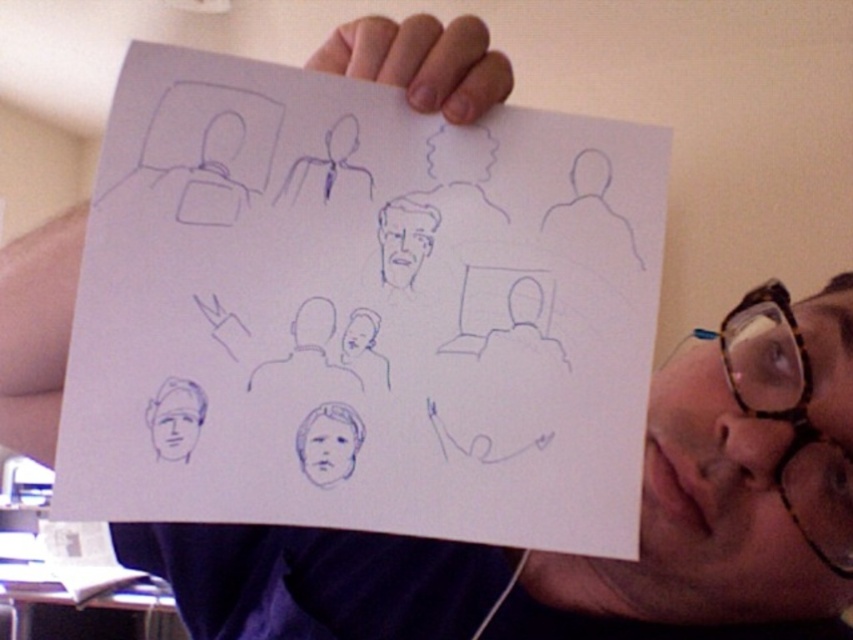
You are an art student who wants to view the blue pencil drawing at center from a distance of at least 40 centimeters to get a better perspective. Based on the information provided, can you stand back far enough to achieve this?

The blue pencil drawing at center is currently 35.65 centimeters away from you. Since 35.65 cm is less than 40 cm, you need to move back an additional 4.35 centimeters to reach the desired distance of 40 centimeters.

In the scene shown: You are an art student who needs to place a 6 inch ruler between the blue pencil drawing at center and the transparent tortoiseshell glasses at upper right. Will the ruler fit between them?

The blue pencil drawing at center and transparent tortoiseshell glasses at upper right are 5.62 inches apart, so the 6 inch ruler will not fit between them because the distance is shorter than the ruler.

You are an artist trying to replicate the drawing in the image. You want to ensure that the two points, point (521,321) and point (390,273), are positioned correctly in terms of depth. Which point should you draw closer to the viewer?

Point (521,321) should be drawn closer to the viewer because it is further to the camera than point (390,273).